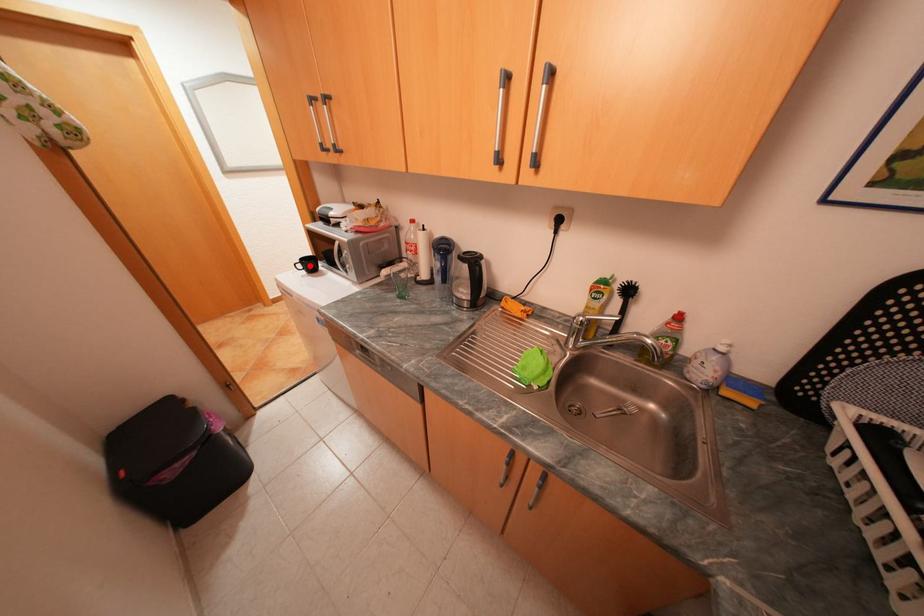
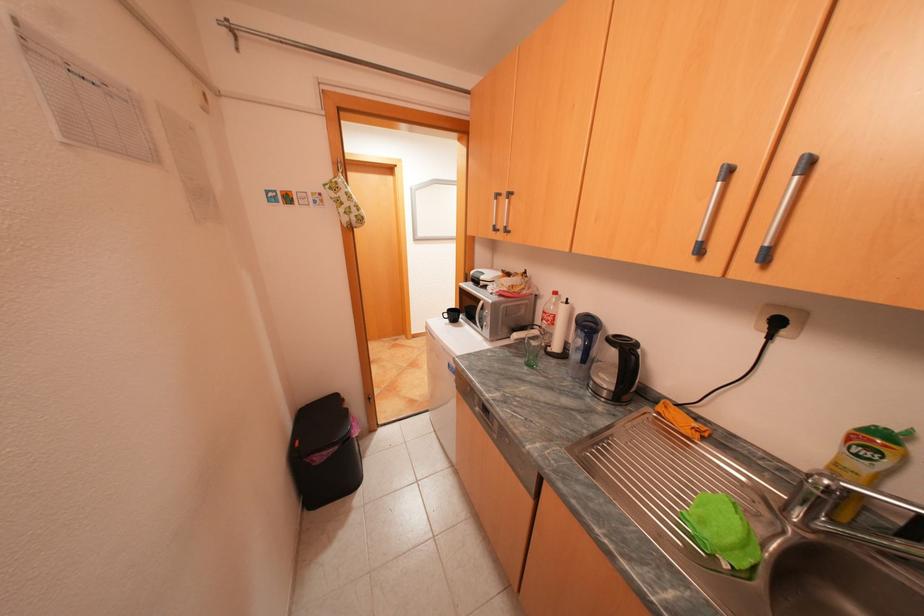
Locate, in the second image, the point that corresponds to the highlighted location in the first image.

(456, 315)